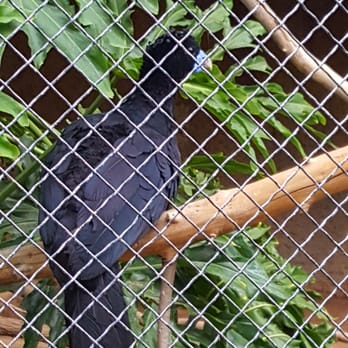
Where is `background wall`? background wall is located at coordinates (67, 85).